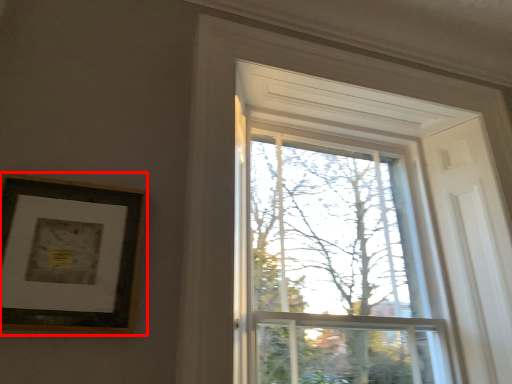
Question: From the image's perspective, where is picture frame (annotated by the red box) located in relation to glass window in the image?

Choices:
 (A) below
 (B) above

Answer: (B)